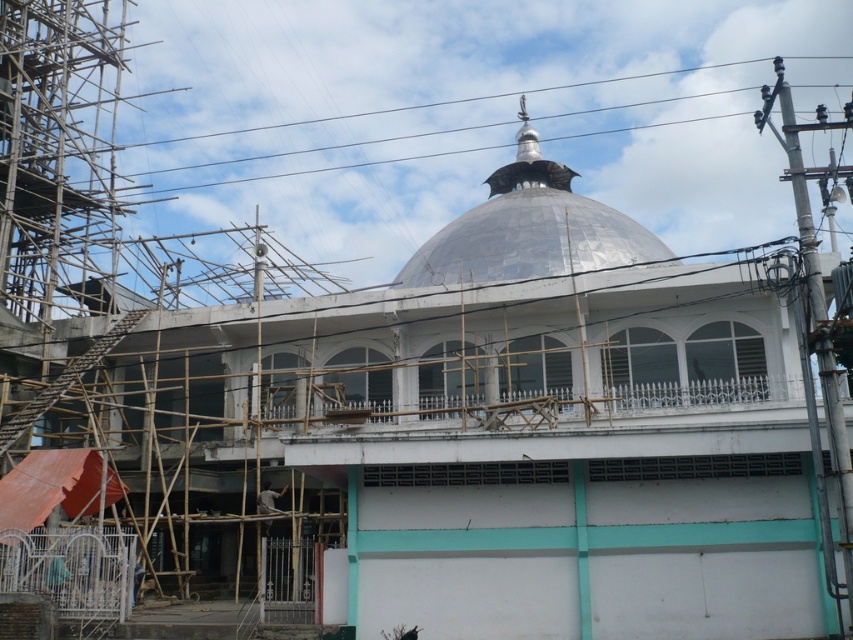
You are a construction inspector checking the safety of the wires and the worker. Based on the image, which object is wider, the metallic wire at upper center or the light brown wooden construction worker at lower left?

The metallic wire at upper center is wider than the light brown wooden construction worker at lower left according to the description.

You are a delivery drone that needs to drop off a package to the construction site. The drone has a maximum delivery range of 30 meters. Can the drone safely deliver the package to the light brown wooden construction worker at lower left from the shiny metallic dome at center?

The distance between the shiny metallic dome at center and the light brown wooden construction worker at lower left is 35.85 meters, which exceeds the drone delivery range of 30 meters. Therefore, the drone cannot safely deliver the package to the light brown wooden construction worker at lower left from the shiny metallic dome at center.